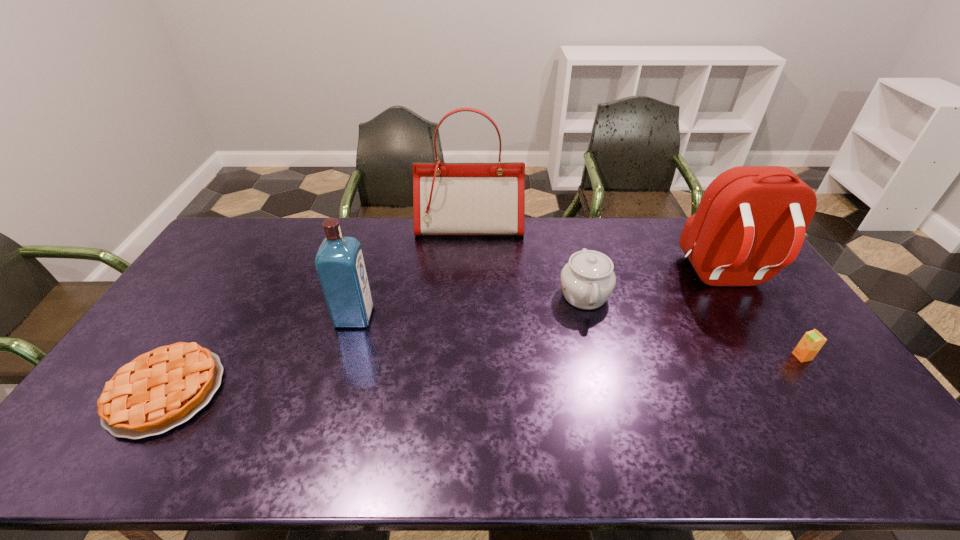
Locate an element on the screen. vacant space in between the pie and the orange juice is located at coordinates (484, 374).

Identify the location of free space between the orange juice and the leftmost object. (484, 374).

Where is `blank region between the farthest object and the third shortest object`? This screenshot has height=540, width=960. blank region between the farthest object and the third shortest object is located at coordinates (527, 261).

Where is `vacant area that lies between the fourth shortest object and the farthest object`? The width and height of the screenshot is (960, 540). vacant area that lies between the fourth shortest object and the farthest object is located at coordinates (412, 272).

Locate an element on the screen. This screenshot has width=960, height=540. free space between the backpack and the second object from left to right is located at coordinates (539, 297).

You are a GUI agent. You are given a task and a screenshot of the screen. Output one action in this format:
    pyautogui.click(x=<x>, y=<y>)
    Task: Click on the vacant area that lies between the third object from right to left and the orange juice
    This screenshot has height=540, width=960.
    Given the screenshot: What is the action you would take?
    pyautogui.click(x=693, y=326)

Image resolution: width=960 pixels, height=540 pixels. I want to click on vacant area that lies between the leftmost object and the backpack, so click(444, 334).

Identify the location of object that ranks as the fourth closest to the pie. This screenshot has height=540, width=960. (750, 223).

This screenshot has width=960, height=540. I want to click on the closest object relative to the backpack, so click(810, 344).

This screenshot has width=960, height=540. What are the coordinates of `free space in the image that satisfies the following two spatial constraints: 1. on the strap side of the orange juice; 2. on the right side of the backpack` in the screenshot? It's located at (774, 356).